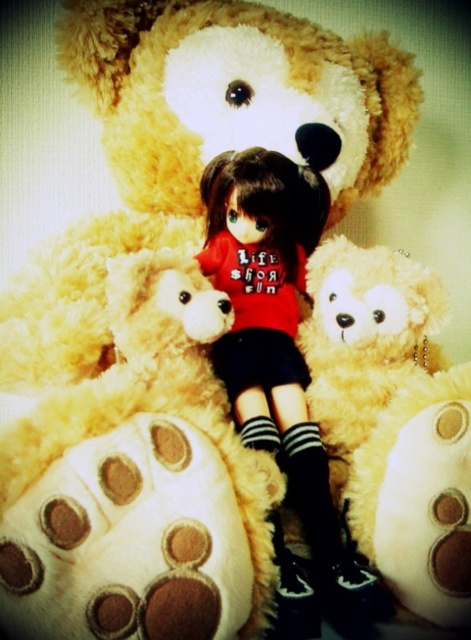
Question: Is fluffy yellow teddy bear at center above matte red shirt at center?

Choices:
 (A) yes
 (B) no

Answer: (B)

Question: Is fluffy yellow teddy bear at center wider than matte red shirt at center?

Choices:
 (A) no
 (B) yes

Answer: (B)

Question: Is fluffy yellow teddy bear at center below matte red shirt at center?

Choices:
 (A) yes
 (B) no

Answer: (A)

Question: Which point appears closest to the camera in this image?

Choices:
 (A) (222, 294)
 (B) (299, 465)

Answer: (A)